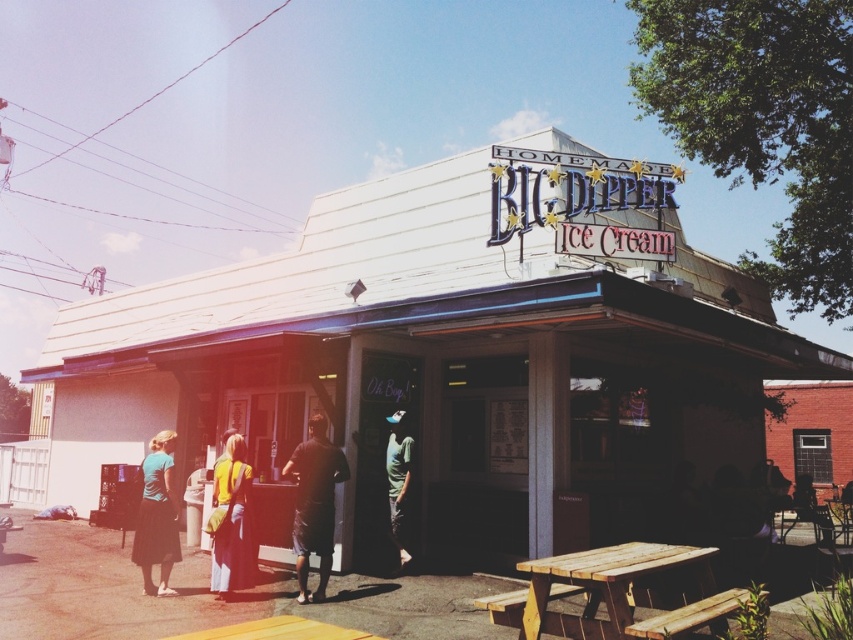
Between white corrugated metal building at center and green cotton shirt at center, which one has less height?

green cotton shirt at center is shorter.

Between point (161, 412) and point (405, 442), which one is positioned in front?

Positioned in front is point (405, 442).

Find the location of `white corrugated metal building at center`. white corrugated metal building at center is located at coordinates (444, 364).

Does wooden picnic table at lower right have a greater width compared to black matte shirt at center?

Indeed, wooden picnic table at lower right has a greater width compared to black matte shirt at center.

Is point (630, 544) more distant than point (312, 445)?

No.

Where is `wooden picnic table at lower right`? The height and width of the screenshot is (640, 853). wooden picnic table at lower right is located at coordinates (610, 593).

Which is in front, point (393, 516) or point (822, 528)?

Point (393, 516)

What do you see at coordinates (398, 480) in the screenshot? I see `green cotton shirt at center` at bounding box center [398, 480].

Find the location of `green cotton shirt at center`. green cotton shirt at center is located at coordinates 398,480.